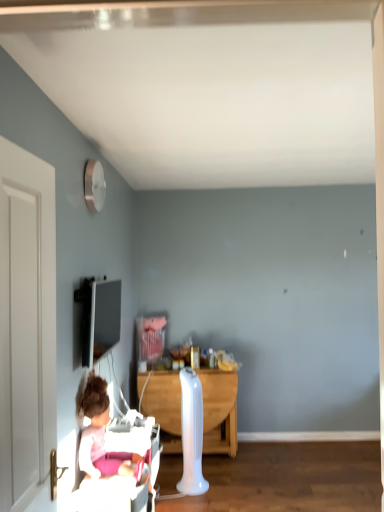
Question: Does white wooden door at left appear on the right side of white plastic radiator at center?

Choices:
 (A) yes
 (B) no

Answer: (B)

Question: Can you confirm if white wooden door at left is shorter than white plastic radiator at center?

Choices:
 (A) yes
 (B) no

Answer: (B)

Question: Could you tell me if white wooden door at left is turned towards white plastic radiator at center?

Choices:
 (A) no
 (B) yes

Answer: (A)

Question: Can you confirm if white wooden door at left is smaller than white plastic radiator at center?

Choices:
 (A) no
 (B) yes

Answer: (B)

Question: Does white wooden door at left have a greater height compared to white plastic radiator at center?

Choices:
 (A) yes
 (B) no

Answer: (A)

Question: From the image's perspective, is white wooden door at left below white plastic radiator at center?

Choices:
 (A) no
 (B) yes

Answer: (A)

Question: Is matte black tv at upper left at the back of pink fabric doll at lower left?

Choices:
 (A) no
 (B) yes

Answer: (A)

Question: Would you consider pink fabric doll at lower left to be distant from matte black tv at upper left?

Choices:
 (A) no
 (B) yes

Answer: (B)

Question: Is pink fabric doll at lower left touching matte black tv at upper left?

Choices:
 (A) no
 (B) yes

Answer: (A)

Question: Does pink fabric doll at lower left have a lesser height compared to matte black tv at upper left?

Choices:
 (A) yes
 (B) no

Answer: (B)

Question: From the image's perspective, is pink fabric doll at lower left on top of matte black tv at upper left?

Choices:
 (A) no
 (B) yes

Answer: (A)

Question: Could you tell me if pink fabric doll at lower left is facing matte black tv at upper left?

Choices:
 (A) yes
 (B) no

Answer: (B)

Question: Considering the relative positions of matte black tv at upper left and white plastic radiator at center in the image provided, is matte black tv at upper left to the left of white plastic radiator at center from the viewer's perspective?

Choices:
 (A) no
 (B) yes

Answer: (B)